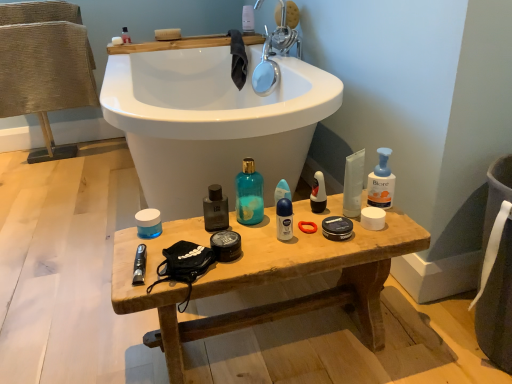
The height and width of the screenshot is (384, 512). I want to click on free area in between white matte deodorant at center, which ranks as the sixth toiletry in top-to-bottom order, and matte black deodorant at center, which is the fourth toiletry from front to back, so click(306, 218).